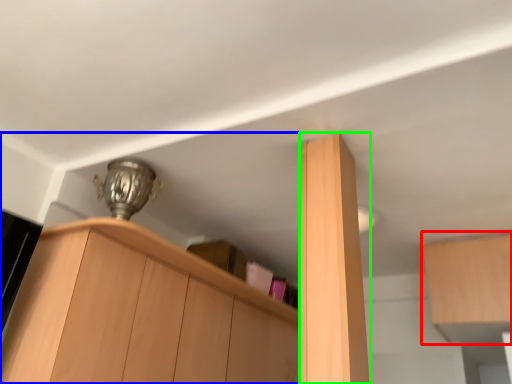
Question: Considering the real-world distances, which object is closest to cabinetry (highlighted by a red box)? cabinetry (highlighted by a blue box) or cabinetry (highlighted by a green box).

Choices:
 (A) cabinetry
 (B) cabinetry

Answer: (B)